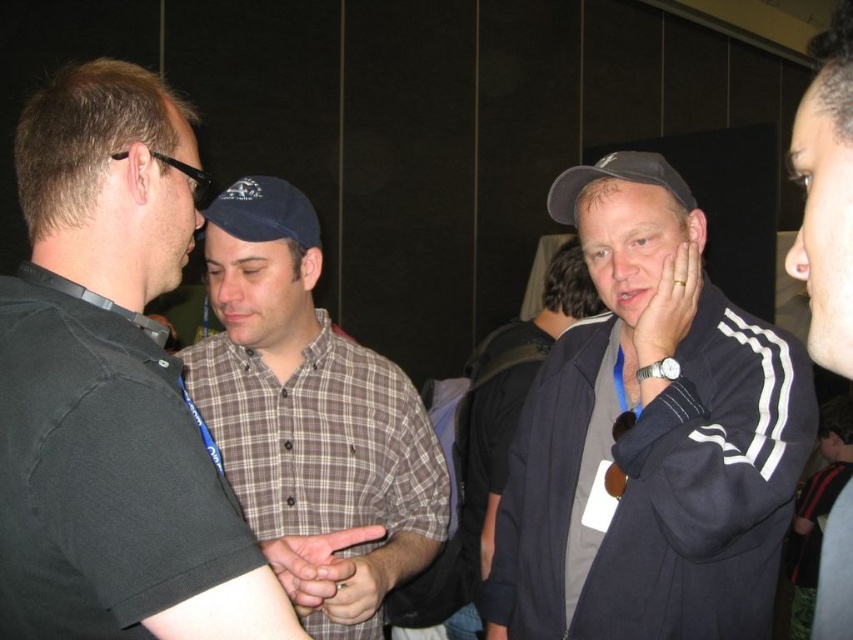
Question: Among these points, which one is nearest to the camera?

Choices:
 (A) (119, 209)
 (B) (633, 172)
 (C) (393, 483)
 (D) (254, 221)

Answer: (A)

Question: Among these objects, which one is nearest to the camera?

Choices:
 (A) black fabric baseball cap at center
 (B) black shirt at left
 (C) dark blue track jacket at center

Answer: (B)

Question: Based on their relative distances, which object is farther from the black shirt at left?

Choices:
 (A) black fabric baseball cap at center
 (B) blue fabric baseball cap at center
 (C) brown plaid shirt at center
 (D) dark blue jacket at center

Answer: (D)

Question: Is brown plaid shirt at center positioned in front of dark blue jacket at center?

Choices:
 (A) no
 (B) yes

Answer: (B)

Question: Does brown plaid shirt at center appear on the left side of black fabric baseball cap at center?

Choices:
 (A) no
 (B) yes

Answer: (B)

Question: Is dark blue track jacket at center to the right of dark blue jacket at center from the viewer's perspective?

Choices:
 (A) no
 (B) yes

Answer: (B)